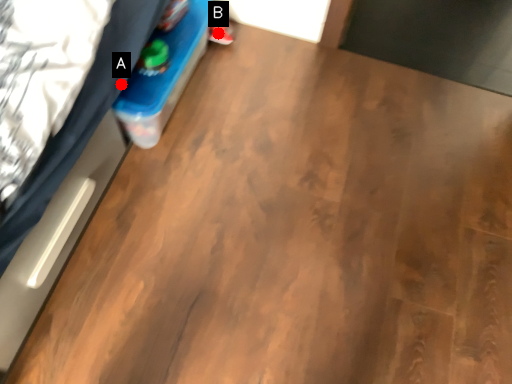
Question: Two points are circled on the image, labeled by A and B beside each circle. Which point is farther to the camera?

Choices:
 (A) A is further
 (B) B is further

Answer: (B)